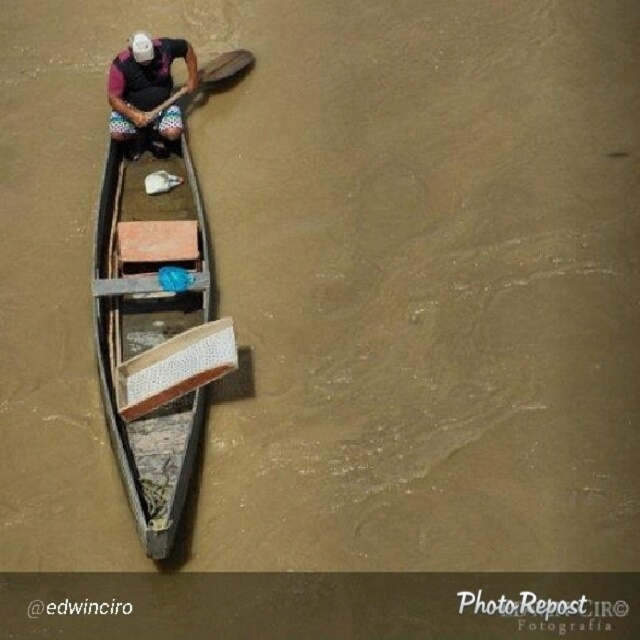
Looking at this image, you are standing on the dock and looking at the wooden canoe at center and the white matte helmet at upper center. Which object is closer to you?

The wooden canoe at center is closer to the viewer than the white matte helmet at upper center.

You are a safety inspector checking the boat for proper equipment placement. According to regulations, all helmets must be stored above the wooden canoe at center to ensure easy access. Is the white matte helmet at upper center in compliance with this requirement?

The wooden canoe at center is positioned under the white matte helmet at upper center, so the helmet is stored above the canoe, which meets the regulation requirement for easy access.